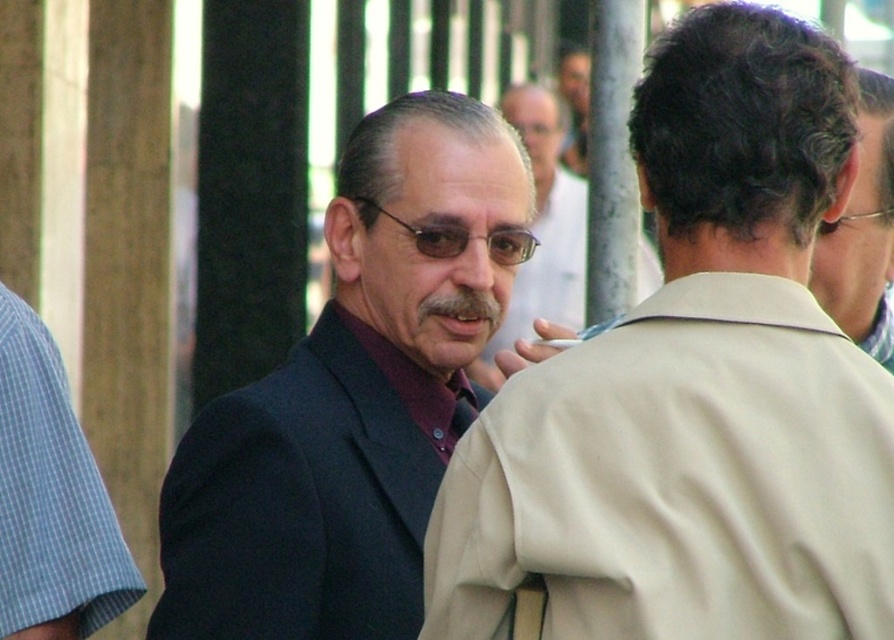
Is beige smooth trench coat at center wider than dark blue suit at center?

Incorrect, beige smooth trench coat at center's width does not surpass dark blue suit at center's.

Does beige smooth trench coat at center appear over dark blue suit at center?

No.

In order to click on beige smooth trench coat at center in this screenshot , I will do `click(679, 481)`.

Can you confirm if beige smooth trench coat at center is smaller than dark brown hair at upper right?

Incorrect, beige smooth trench coat at center is not smaller in size than dark brown hair at upper right.

This screenshot has width=894, height=640. Describe the element at coordinates (679, 481) in the screenshot. I see `beige smooth trench coat at center` at that location.

The height and width of the screenshot is (640, 894). What are the coordinates of `beige smooth trench coat at center` in the screenshot? It's located at (679, 481).

Is dark blue suit at center thinner than dark brown hair at upper right?

No.

Can you confirm if dark blue suit at center is wider than dark brown hair at upper right?

Yes, dark blue suit at center is wider than dark brown hair at upper right.

Between point (266, 396) and point (890, 134), which one is positioned behind?

Point (266, 396)

Where is `dark blue suit at center`? The image size is (894, 640). dark blue suit at center is located at coordinates (353, 396).